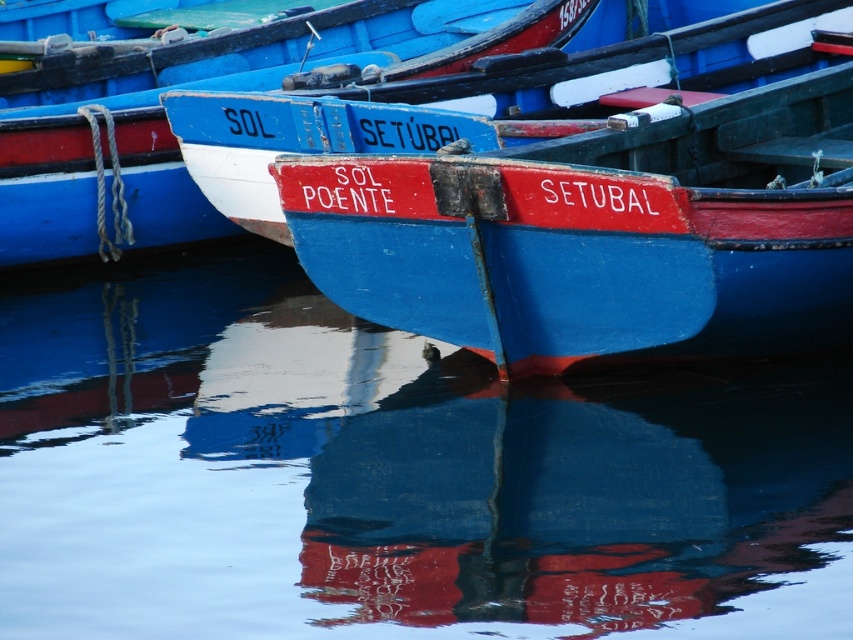
You are standing on the dock and see two boats at the center of the image. Which boat is closer to you, the blue wooden boat at center or the matte blue boat at center?

The blue wooden boat at center is closer to you because it is further to the viewer than the matte blue boat at center.

You are standing on the dock and want to place a 2.5 meter long floating platform between the glossy blue water at center and the matte blue boat at center. Can the platform fit in the space between them?

The glossy blue water at center is 3.09 meters away from the matte blue boat at center. Since the platform is 2.5 meters long, it can fit in the space between them as the distance is greater than the platform length.

You are standing on the dock and see the glossy blue water at center and the matte blue boat at center. Which object is positioned to the right of the other?

The glossy blue water at center is to the right of the matte blue boat at center.